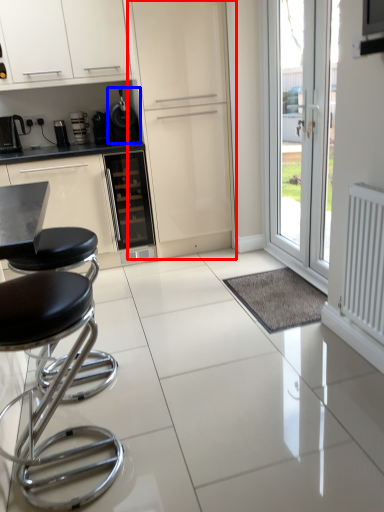
Question: Which object appears farthest to the camera in this image, screen door (highlighted by a red box) or appliance (highlighted by a blue box)?

Choices:
 (A) screen door
 (B) appliance

Answer: (B)